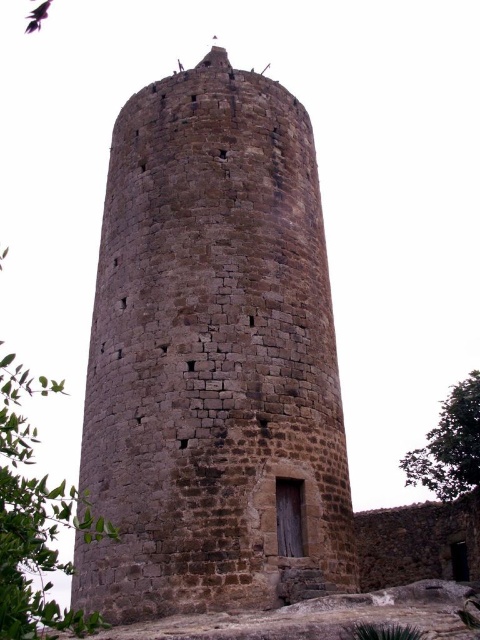
You are standing at the base of the brown stone tower at center and want to look at the green leafy tree at right. In which direction should you turn your head to see the tree?

The brown stone tower at center is located above the green leafy tree at right, so you should look downward to see the tree.

You are standing at the base of the stone tower and want to take a photo of the green leafy tree at left. Which direction should you face to capture the tree in your shot?

The green leafy tree at left is located at point [35,518], which is to the left side of the tower. Therefore, you should face towards the left direction to capture the tree in your shot.

You are standing in front of the medieval tower and want to determine the relative positions of two specific points on its surface. The first point is located at coordinates point (24, 444), and the second is at point (447, 417). Which of these points is closer to your current position?

Point (24, 444) is closer to your current position because it is further to the viewer than point (447, 417), meaning it protrudes more towards you compared to the other point which is positioned further back.